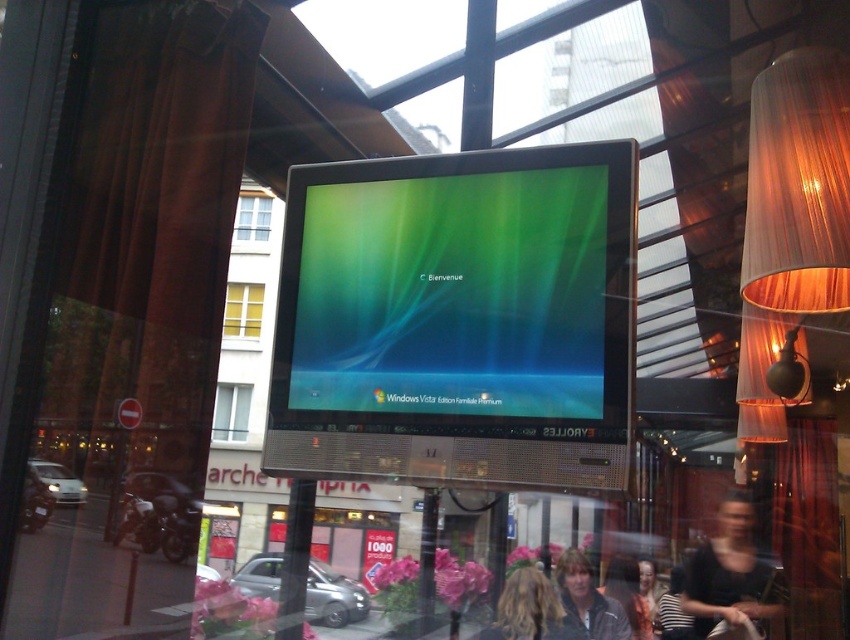
Between blonde hair at center and matte black jacket at lower center, which one is positioned lower?

matte black jacket at lower center is lower down.

The height and width of the screenshot is (640, 850). What do you see at coordinates (527, 609) in the screenshot?
I see `blonde hair at center` at bounding box center [527, 609].

Locate an element on the screen. This screenshot has height=640, width=850. blonde hair at center is located at coordinates (527, 609).

Can you confirm if white plastic window at center is positioned to the right of matte black jacket at lower center?

In fact, white plastic window at center is to the left of matte black jacket at lower center.

Is point (248, 397) closer to camera compared to point (655, 605)?

That is False.

Who is more distant from viewer, (225, 406) or (646, 557)?

The point (225, 406) is more distant.

The width and height of the screenshot is (850, 640). Find the location of `white plastic window at center`. white plastic window at center is located at coordinates (231, 412).

How distant is yellow glass window at upper left from white plastic window at center?

The distance of yellow glass window at upper left from white plastic window at center is 33.29 inches.

Describe the element at coordinates (242, 308) in the screenshot. Image resolution: width=850 pixels, height=640 pixels. I see `yellow glass window at upper left` at that location.

Where is `yellow glass window at upper left`? yellow glass window at upper left is located at coordinates (242, 308).